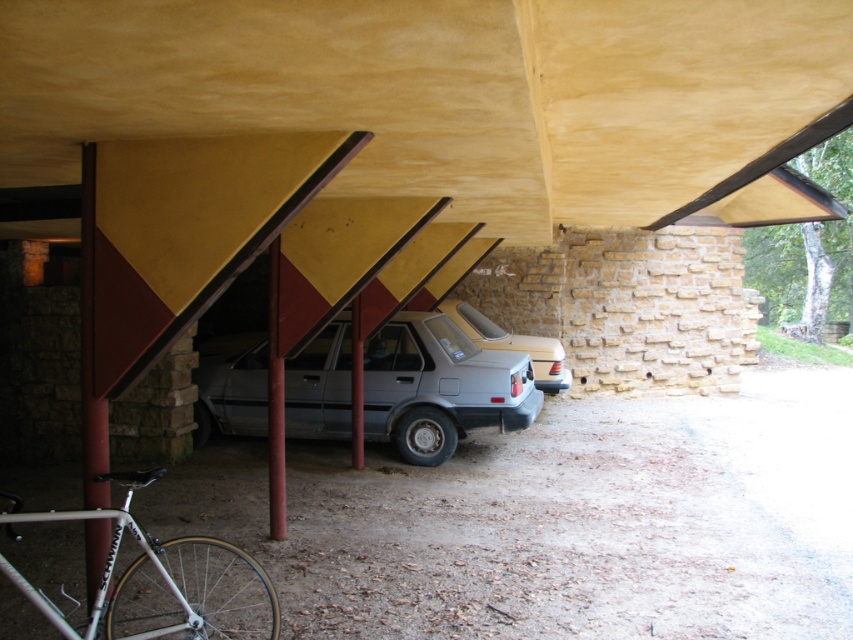
Question: Which point is closer to the camera?

Choices:
 (A) silver metallic bicycle at lower left
 (B) silver metallic sedan at center

Answer: (A)

Question: Which point is closer to the camera?

Choices:
 (A) silver metallic bicycle at lower left
 (B) satin gray sedan at center

Answer: (A)

Question: Is silver metallic bicycle at lower left wider than silver metallic sedan at center?

Choices:
 (A) no
 (B) yes

Answer: (A)

Question: Is satin gray sedan at center behind silver metallic bicycle at lower left?

Choices:
 (A) no
 (B) yes

Answer: (B)

Question: Is satin gray sedan at center to the right of silver metallic bicycle at lower left from the viewer's perspective?

Choices:
 (A) no
 (B) yes

Answer: (B)

Question: Among these points, which one is farthest from the camera?

Choices:
 (A) (544, 339)
 (B) (96, 621)
 (C) (300, 403)

Answer: (A)